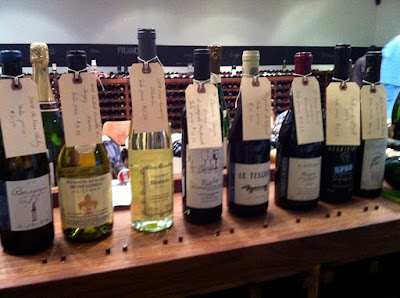
In order to click on front of wooden bar in this screenshot , I will do `click(390, 238)`, `click(288, 245)`, `click(198, 277)`, `click(124, 288)`.